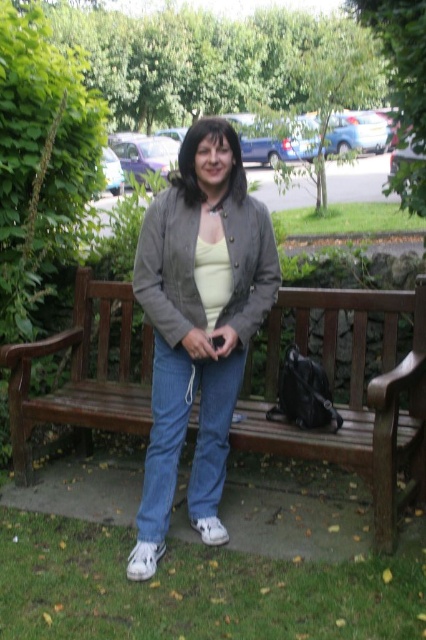
Question: Can you confirm if matte gray jacket at center is positioned above brown wooden bench at center?

Choices:
 (A) no
 (B) yes

Answer: (B)

Question: Which point is closer to the camera?

Choices:
 (A) (77, 388)
 (B) (229, 193)

Answer: (B)

Question: Observing the image, what is the correct spatial positioning of matte gray jacket at center in reference to brown wooden bench at center?

Choices:
 (A) above
 (B) below

Answer: (A)

Question: Does matte gray jacket at center appear on the left side of brown wooden bench at center?

Choices:
 (A) no
 (B) yes

Answer: (B)